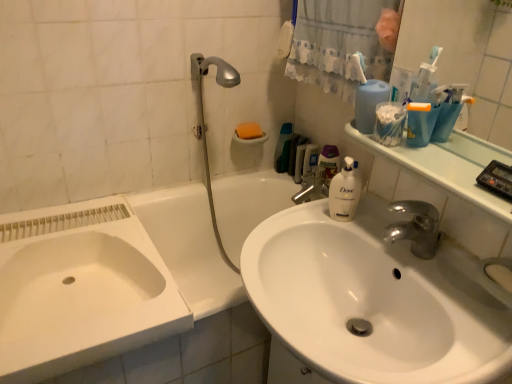
The width and height of the screenshot is (512, 384). What are the coordinates of `vacant space in front of white plastic cotton swabs at upper right, which is the 1th mouthwash in front-to-back order` in the screenshot? It's located at (432, 169).